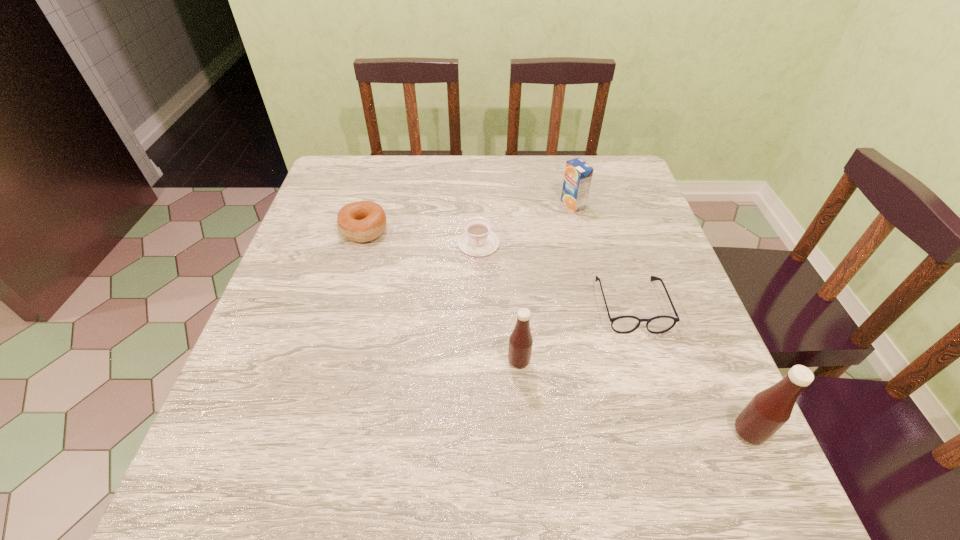
Where is `the left Tabasco sauce`? the left Tabasco sauce is located at coordinates (520, 342).

The image size is (960, 540). Identify the location of the farther Tabasco sauce. (520, 342).

At what (x,y) coordinates should I click in order to perform the action: click on the taller Tabasco sauce. Please return your answer as a coordinate pair (x, y). Looking at the image, I should click on click(770, 409).

Find the location of `the nearer Tabasco sauce`. the nearer Tabasco sauce is located at coordinates (770, 409).

At what (x,y) coordinates should I click in order to perform the action: click on bagel. Please return your answer as a coordinate pair (x, y). The height and width of the screenshot is (540, 960). Looking at the image, I should click on pyautogui.click(x=363, y=221).

Image resolution: width=960 pixels, height=540 pixels. Identify the location of teacup. (478, 240).

The image size is (960, 540). I want to click on orange_juice, so click(578, 174).

Where is `the third tallest object`? the third tallest object is located at coordinates (578, 174).

This screenshot has width=960, height=540. I want to click on the third nearest object, so click(x=625, y=324).

I want to click on vacant space situated 0.120m on the front of the third object from left to right, so click(x=524, y=431).